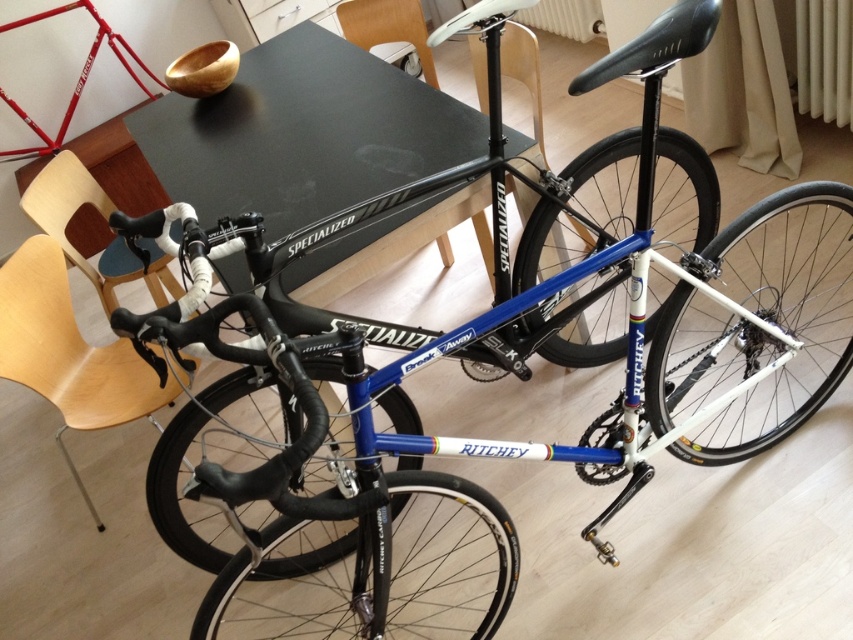
You are trying to decide which chair to sit on while having a meal in the dining area. The light wood chair at lower left and the wooden chair at center are both available. Which chair has a larger size?

The light wood chair at lower left is bigger than the wooden chair at center, so it has a larger size.

You are a guest at a dinner party and need to choose between the wooden chair at center and the wooden chair at upper center. Which chair should you sit on if you want to have a better view of the table?

You should sit on the wooden chair at upper center because it is taller than the wooden chair at center, providing a better view of the table.

You are trying to decide whether to place a 1.2 meter tall potted plant between the black matte table at upper center and the wooden chair at left. Considering their heights, will the plant fit vertically between them without touching either object?

The black matte table at upper center is much taller than the wooden chair at left. Since the plant is 1.2 meters tall, it might not fit between them if the distance between the table and chair is too narrow. However, the description only mentions height comparison, not horizontal spacing. Therefore, based on vertical clearance alone, the plant could fit if placed appropriately between them.